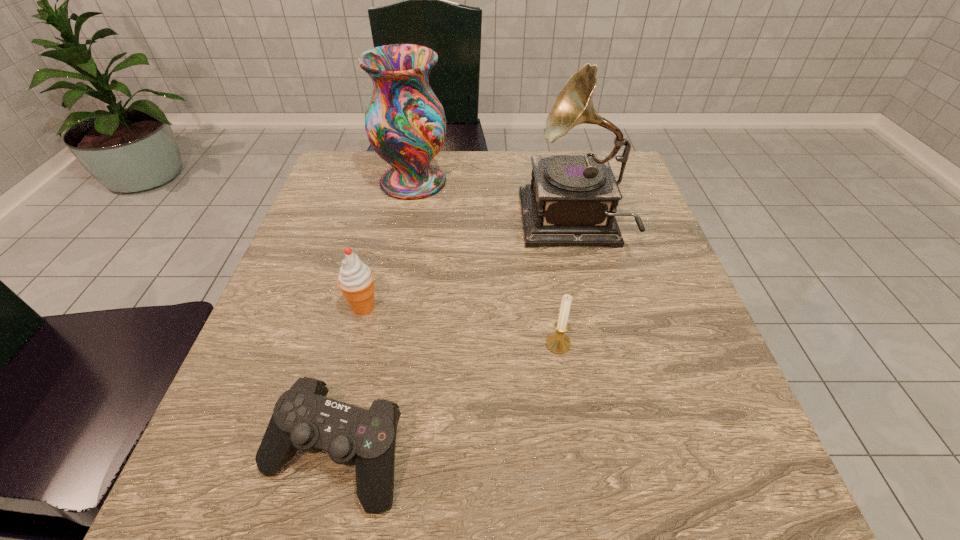
The width and height of the screenshot is (960, 540). Identify the location of free point between the third farthest object and the shortest object. (348, 381).

At what (x,y) coordinates should I click in order to perform the action: click on object that is the fourth closest to the icecream. Please return your answer as a coordinate pair (x, y). Looking at the image, I should click on (558, 342).

You are a GUI agent. You are given a task and a screenshot of the screen. Output one action in this format:
    pyautogui.click(x=<x>, y=<y>)
    Task: Click on the object that ranks as the second closest to the vase
    The width and height of the screenshot is (960, 540).
    Given the screenshot: What is the action you would take?
    (x=356, y=280)

Identify the location of free space that satisfies the following two spatial constraints: 1. on the back side of the candle holder; 2. on the right side of the nearest object. (360, 344).

Find the location of `free space that satisfies the following two spatial constraints: 1. on the front side of the second nearest object; 2. on the right side of the vase`. free space that satisfies the following two spatial constraints: 1. on the front side of the second nearest object; 2. on the right side of the vase is located at coordinates (382, 344).

Find the location of a particular element. The image size is (960, 540). vacant space that satisfies the following two spatial constraints: 1. on the back side of the candle holder; 2. on the left side of the nearest object is located at coordinates (360, 344).